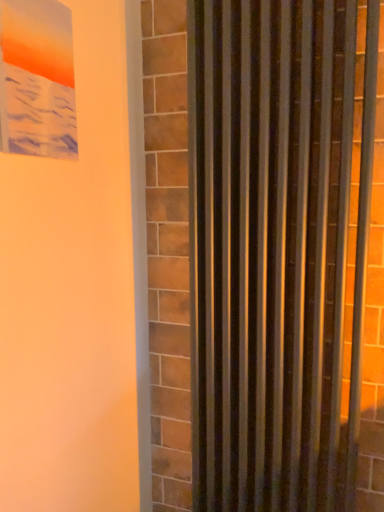
This screenshot has height=512, width=384. What do you see at coordinates (275, 250) in the screenshot?
I see `metallic silver curtain at right` at bounding box center [275, 250].

Where is `metallic silver curtain at right`? This screenshot has height=512, width=384. metallic silver curtain at right is located at coordinates (275, 250).

What do you see at coordinates (37, 79) in the screenshot?
I see `matte plastic picture frame at upper left` at bounding box center [37, 79].

Locate an element on the screen. This screenshot has height=512, width=384. matte plastic picture frame at upper left is located at coordinates (37, 79).

Identify the location of metallic silver curtain at right. (275, 250).

Visually, is metallic silver curtain at right positioned to the left or to the right of matte plastic picture frame at upper left?

Based on their positions, metallic silver curtain at right is located to the right of matte plastic picture frame at upper left.

Who is more distant, metallic silver curtain at right or matte plastic picture frame at upper left?

metallic silver curtain at right is further away from the camera.

Which is closer, (216, 511) or (9, 105)?

Point (216, 511) is farther from the camera than point (9, 105).

From the image's perspective, is metallic silver curtain at right beneath matte plastic picture frame at upper left?

Indeed, from the image's perspective, metallic silver curtain at right is shown beneath matte plastic picture frame at upper left.

From a real-world perspective, is metallic silver curtain at right physically located above or below matte plastic picture frame at upper left?

From a real-world perspective, metallic silver curtain at right is physically below matte plastic picture frame at upper left.

Can you confirm if metallic silver curtain at right is wider than matte plastic picture frame at upper left?

Correct, the width of metallic silver curtain at right exceeds that of matte plastic picture frame at upper left.

Considering the relative sizes of metallic silver curtain at right and matte plastic picture frame at upper left in the image provided, is metallic silver curtain at right taller than matte plastic picture frame at upper left?

Yes.

Based on their sizes in the image, would you say metallic silver curtain at right is bigger or smaller than matte plastic picture frame at upper left?

In the image, metallic silver curtain at right appears to be larger than matte plastic picture frame at upper left.

Is metallic silver curtain at right inside the boundaries of matte plastic picture frame at upper left, or outside?

metallic silver curtain at right is not inside matte plastic picture frame at upper left, it's outside.

Is metallic silver curtain at right directly adjacent to matte plastic picture frame at upper left?

No, metallic silver curtain at right is not next to matte plastic picture frame at upper left.

Does metallic silver curtain at right turn towards matte plastic picture frame at upper left?

Yes, metallic silver curtain at right is aimed at matte plastic picture frame at upper left.

How far apart are metallic silver curtain at right and matte plastic picture frame at upper left?

They are 21.39 inches apart.

Identify the location of picture frame in front of the metallic silver curtain at right. The height and width of the screenshot is (512, 384). (37, 79).

Considering the relative positions of matte plastic picture frame at upper left and metallic silver curtain at right in the image provided, is matte plastic picture frame at upper left to the left or to the right of metallic silver curtain at right?

matte plastic picture frame at upper left is positioned on metallic silver curtain at right's left side.

Is matte plastic picture frame at upper left further to camera compared to metallic silver curtain at right?

That is False.

Considering the positions of point (40, 105) and point (203, 78), is point (40, 105) closer or farther from the camera than point (203, 78)?

Point (40, 105).

From the image's perspective, which object appears higher, matte plastic picture frame at upper left or metallic silver curtain at right?

matte plastic picture frame at upper left appears higher in the image.

From a real-world perspective, which object rests below the other?

metallic silver curtain at right is physically lower.

Considering the sizes of objects matte plastic picture frame at upper left and metallic silver curtain at right in the image provided, who is wider, matte plastic picture frame at upper left or metallic silver curtain at right?

metallic silver curtain at right.

Considering the sizes of matte plastic picture frame at upper left and metallic silver curtain at right in the image, is matte plastic picture frame at upper left taller or shorter than metallic silver curtain at right?

In the image, matte plastic picture frame at upper left appears to be shorter than metallic silver curtain at right.

Considering the relative sizes of matte plastic picture frame at upper left and metallic silver curtain at right in the image provided, is matte plastic picture frame at upper left bigger than metallic silver curtain at right?

Incorrect, matte plastic picture frame at upper left is not larger than metallic silver curtain at right.

Is metallic silver curtain at right surrounded by matte plastic picture frame at upper left?

That's incorrect, metallic silver curtain at right is not inside matte plastic picture frame at upper left.

Are matte plastic picture frame at upper left and metallic silver curtain at right beside each other?

No, matte plastic picture frame at upper left is not making contact with metallic silver curtain at right.

Is metallic silver curtain at right at the back of matte plastic picture frame at upper left?

No, matte plastic picture frame at upper left is not facing the opposite direction of metallic silver curtain at right.

What's the angular difference between matte plastic picture frame at upper left and metallic silver curtain at right's facing directions?

The angle between the facing direction of matte plastic picture frame at upper left and the facing direction of metallic silver curtain at right is 93 degrees.

Measure the distance from matte plastic picture frame at upper left to metallic silver curtain at right.

54.34 centimeters.

Locate an element on the screen. The width and height of the screenshot is (384, 512). curtain that is under the matte plastic picture frame at upper left (from a real-world perspective) is located at coordinates (275, 250).

Where is `curtain that is behind the matte plastic picture frame at upper left`? This screenshot has height=512, width=384. curtain that is behind the matte plastic picture frame at upper left is located at coordinates (275, 250).

The width and height of the screenshot is (384, 512). I want to click on picture frame above the metallic silver curtain at right (from the image's perspective), so click(37, 79).